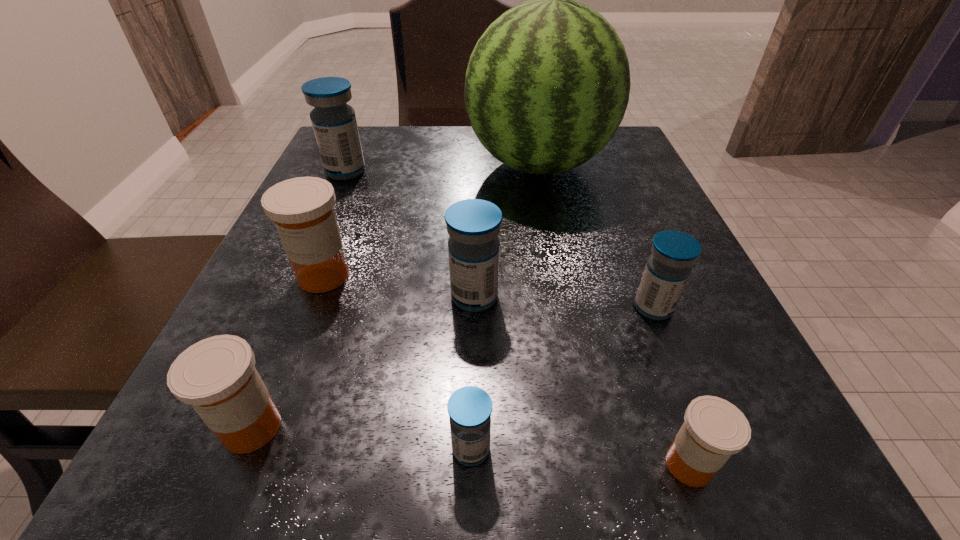
Where is `free spot between the third smallest blue medicine and the smallest blue medicine`? free spot between the third smallest blue medicine and the smallest blue medicine is located at coordinates (472, 373).

Find the location of `free space between the farthest orange medicine and the second biggest blue medicine`. free space between the farthest orange medicine and the second biggest blue medicine is located at coordinates (399, 286).

Identify which object is the second nearest to the second smallest orange medicine. Please provide its 2D coordinates. Your answer should be formatted as a tuple, i.e. [(x, y)], where the tuple contains the x and y coordinates of a point satisfying the conditions above.

[(470, 407)]

Locate which object is the sixth closest to the green watermelon. Please provide its 2D coordinates. Your answer should be formatted as a tuple, i.e. [(x, y)], where the tuple contains the x and y coordinates of a point satisfying the conditions above.

[(217, 376)]

Identify which medicine is the nearest to the third biggest blue medicine. Please provide its 2D coordinates. Your answer should be formatted as a tuple, i.e. [(x, y)], where the tuple contains the x and y coordinates of a point satisfying the conditions above.

[(713, 429)]

Identify which medicine is located as the fifth nearest to the second smallest blue medicine. Please provide its 2D coordinates. Your answer should be formatted as a tuple, i.e. [(x, y)], where the tuple contains the x and y coordinates of a point satisfying the conditions above.

[(217, 376)]

This screenshot has height=540, width=960. Find the location of `the second closest blue medicine relative to the farthest blue medicine`. the second closest blue medicine relative to the farthest blue medicine is located at coordinates (667, 270).

Select which blue medicine appears as the second closest to the second smallest orange medicine. Please provide its 2D coordinates. Your answer should be formatted as a tuple, i.e. [(x, y)], where the tuple contains the x and y coordinates of a point satisfying the conditions above.

[(473, 225)]

Point out which orange medicine is positioned as the nearest to the farthest medicine. Please provide its 2D coordinates. Your answer should be formatted as a tuple, i.e. [(x, y)], where the tuple contains the x and y coordinates of a point satisfying the conditions above.

[(302, 209)]

Find the location of a particular element. the closest orange medicine to the farthest orange medicine is located at coordinates (217, 376).